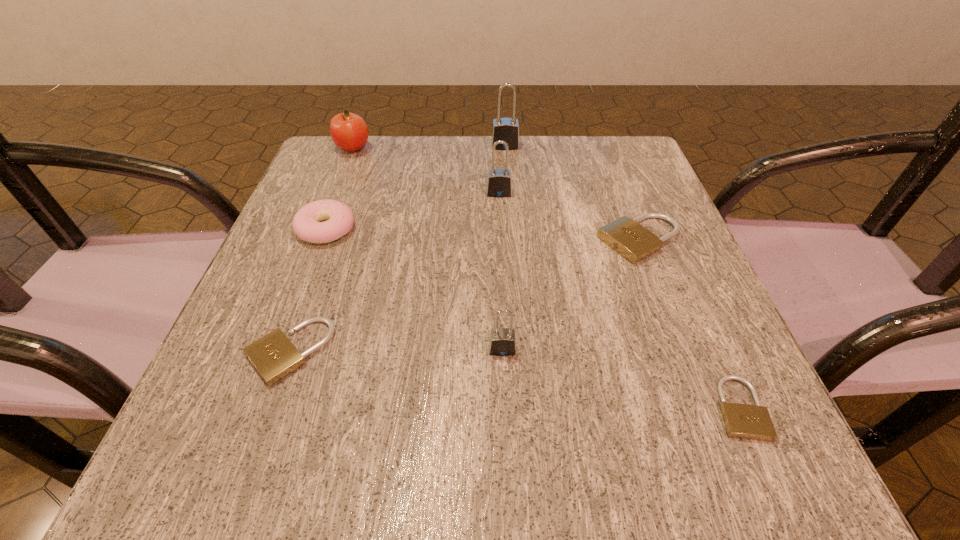
The width and height of the screenshot is (960, 540). I want to click on the farthest padlock, so click(x=506, y=129).

Where is `the tallest padlock`? The width and height of the screenshot is (960, 540). the tallest padlock is located at coordinates (506, 129).

What are the coordinates of `the second biggest gray padlock` in the screenshot? It's located at (499, 184).

Where is `the second farthest gray padlock`? the second farthest gray padlock is located at coordinates (499, 184).

Identify the location of apple. (349, 131).

Where is `the nearest gray padlock`? The height and width of the screenshot is (540, 960). the nearest gray padlock is located at coordinates (502, 342).

At what (x,y) coordinates should I click in order to perform the action: click on the fourth tallest object. Please return your answer as a coordinate pair (x, y). Image resolution: width=960 pixels, height=540 pixels. Looking at the image, I should click on click(502, 342).

This screenshot has height=540, width=960. Find the location of `doughnut`. doughnut is located at coordinates (307, 225).

Where is `pink doughnut`? pink doughnut is located at coordinates (307, 225).

Where is `the biggest beige padlock`? The height and width of the screenshot is (540, 960). the biggest beige padlock is located at coordinates (626, 236).